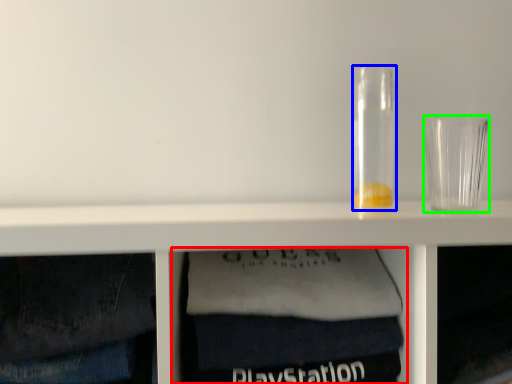
Question: Which is farther away from cabinet (highlighted by a red box)? glass jar (highlighted by a blue box) or shot glass (highlighted by a green box)?

Choices:
 (A) glass jar
 (B) shot glass

Answer: (B)